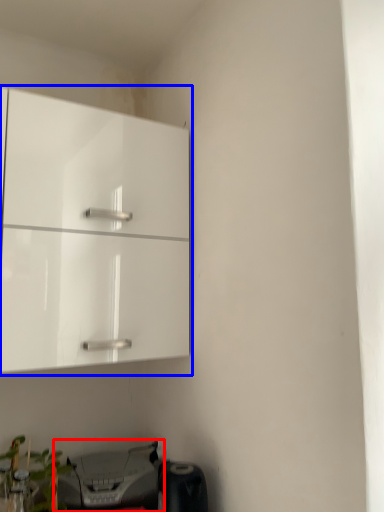
Question: Which object is closer to the camera taking this photo, printer (highlighted by a red box) or cabinetry (highlighted by a blue box)?

Choices:
 (A) printer
 (B) cabinetry

Answer: (B)